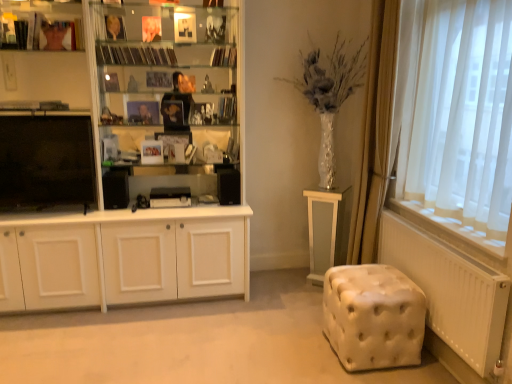
Question: Are hardcover book at upper center, placed as the 2th book when sorted from right to left, and matte black books at upper left located far from each other?

Choices:
 (A) yes
 (B) no

Answer: (A)

Question: Can you confirm if hardcover book at upper center, the 3th book in the left-to-right sequence, is positioned to the left of matte black books at upper left?

Choices:
 (A) yes
 (B) no

Answer: (B)

Question: Does hardcover book at upper center, the 3th book in the left-to-right sequence, have a greater width compared to matte black books at upper left?

Choices:
 (A) no
 (B) yes

Answer: (B)

Question: Is hardcover book at upper center, the 3th book in the left-to-right sequence, not inside matte black books at upper left?

Choices:
 (A) no
 (B) yes

Answer: (B)

Question: Does hardcover book at upper center, the 3th book in the left-to-right sequence, come in front of matte black books at upper left?

Choices:
 (A) no
 (B) yes

Answer: (A)

Question: Considering the relative positions of hardcover book at upper center, placed as the 2th book when sorted from right to left, and matte black books at upper left in the image provided, is hardcover book at upper center, placed as the 2th book when sorted from right to left, to the right of matte black books at upper left from the viewer's perspective?

Choices:
 (A) yes
 (B) no

Answer: (A)

Question: Is black matte bookshelf at upper center, the second book from the left, smaller than gold metallic book at upper center, marked as the 1th book in a left-to-right arrangement?

Choices:
 (A) yes
 (B) no

Answer: (B)

Question: Considering the relative positions of black matte bookshelf at upper center, the second book from the left, and gold metallic book at upper center, marked as the 1th book in a left-to-right arrangement, in the image provided, is black matte bookshelf at upper center, the second book from the left, to the left of gold metallic book at upper center, marked as the 1th book in a left-to-right arrangement, from the viewer's perspective?

Choices:
 (A) no
 (B) yes

Answer: (A)

Question: From a real-world perspective, is black matte bookshelf at upper center, the third book when ordered from right to left, located higher than gold metallic book at upper center, marked as the 1th book in a left-to-right arrangement?

Choices:
 (A) yes
 (B) no

Answer: (B)

Question: Is black matte bookshelf at upper center, the third book when ordered from right to left, completely or partially outside of gold metallic book at upper center, the 4th book viewed from the right?

Choices:
 (A) no
 (B) yes

Answer: (B)

Question: Does black matte bookshelf at upper center, the third book when ordered from right to left, come behind gold metallic book at upper center, marked as the 1th book in a left-to-right arrangement?

Choices:
 (A) no
 (B) yes

Answer: (B)

Question: Is black matte bookshelf at upper center, the third book when ordered from right to left, shorter than gold metallic book at upper center, the 4th book viewed from the right?

Choices:
 (A) no
 (B) yes

Answer: (B)

Question: Are white tufted ottoman at lower right and white glossy cupboard at left making contact?

Choices:
 (A) no
 (B) yes

Answer: (A)